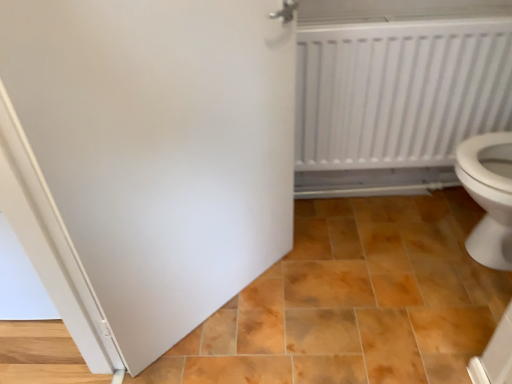
The width and height of the screenshot is (512, 384). What do you see at coordinates (149, 157) in the screenshot? I see `white matte door at center` at bounding box center [149, 157].

This screenshot has width=512, height=384. What do you see at coordinates (399, 88) in the screenshot?
I see `white plastic radiator at upper right` at bounding box center [399, 88].

This screenshot has height=384, width=512. What are the coordinates of `white matte door at center` in the screenshot? It's located at (149, 157).

Is white plastic radiator at upper right facing towards white matte door at center?

No, white plastic radiator at upper right is not turned towards white matte door at center.

How many degrees apart are the facing directions of white plastic radiator at upper right and white matte door at center?

44.3 degrees separate the facing orientations of white plastic radiator at upper right and white matte door at center.

Between white plastic radiator at upper right and white matte door at center, which one has more height?

Standing taller between the two is white matte door at center.

From a real-world perspective, is white plastic radiator at upper right positioned under white matte door at center based on gravity?

Yes, from a real-world perspective, white plastic radiator at upper right is below white matte door at center.

How different are the orientations of white matte door at center and brown glossy tile at center in degrees?

The angular difference between white matte door at center and brown glossy tile at center is 135 degrees.

Considering the sizes of objects white matte door at center and brown glossy tile at center in the image provided, who is thinner, white matte door at center or brown glossy tile at center?

With smaller width is white matte door at center.

Is white matte door at center beside brown glossy tile at center?

No, white matte door at center is not beside brown glossy tile at center.

In the image, there is a brown glossy tile at center. In order to click on door above it (from the image's perspective) in this screenshot , I will do `click(149, 157)`.

Considering the relative sizes of white matte door at center and white plastic radiator at upper right in the image provided, is white matte door at center taller than white plastic radiator at upper right?

Indeed, white matte door at center has a greater height compared to white plastic radiator at upper right.

This screenshot has width=512, height=384. I want to click on door below the white plastic radiator at upper right (from the image's perspective), so click(149, 157).

Would you say white matte door at center is a long distance from white plastic radiator at upper right?

They are positioned close to each other.

Looking at their sizes, would you say brown glossy tile at center is wider or thinner than white matte door at center?

Considering their sizes, brown glossy tile at center looks broader than white matte door at center.

Considering the sizes of brown glossy tile at center and white matte door at center in the image, is brown glossy tile at center bigger or smaller than white matte door at center?

brown glossy tile at center is bigger than white matte door at center.

Where is `door in front of the brown glossy tile at center`? The height and width of the screenshot is (384, 512). door in front of the brown glossy tile at center is located at coordinates (149, 157).

From the image's perspective, between brown glossy tile at center and white matte door at center, who is located below?

brown glossy tile at center, from the image's perspective.

Between brown glossy tile at center and white plastic radiator at upper right, which one has more height?

white plastic radiator at upper right.

Are brown glossy tile at center and white plastic radiator at upper right located far from each other?

That's not correct — brown glossy tile at center is a little close to white plastic radiator at upper right.

At what (x,y) coordinates should I click in order to perform the action: click on ceramic tile in front of the white plastic radiator at upper right. Please return your answer as a coordinate pair (x, y). This screenshot has width=512, height=384. Looking at the image, I should click on (355, 301).

Which is in front, point (488, 24) or point (418, 362)?

The point (418, 362) is closer.

Looking at the image, does white plastic radiator at upper right seem bigger or smaller compared to brown glossy tile at center?

In the image, white plastic radiator at upper right appears to be smaller than brown glossy tile at center.

Which object is positioned more to the right, white plastic radiator at upper right or brown glossy tile at center?

From the viewer's perspective, white plastic radiator at upper right appears more on the right side.

From a real-world perspective, which is physically above, white plastic radiator at upper right or brown glossy tile at center?

In real-world perspective, white plastic radiator at upper right is above.

Locate an element on the screen. This screenshot has height=384, width=512. radiator behind the white matte door at center is located at coordinates (399, 88).

Locate an element on the screen. The width and height of the screenshot is (512, 384). door in front of the brown glossy tile at center is located at coordinates (149, 157).

Based on their spatial positions, is white matte door at center or white plastic radiator at upper right further from brown glossy tile at center?

white plastic radiator at upper right is further to brown glossy tile at center.

Which object lies nearer to the anchor point brown glossy tile at center, white plastic radiator at upper right or white matte door at center?

Among the two, white matte door at center is located nearer to brown glossy tile at center.

Considering their positions, is brown glossy tile at center positioned further to white plastic radiator at upper right than white matte door at center?

The object further to white plastic radiator at upper right is white matte door at center.

From the image, which object appears to be farther from white matte door at center, brown glossy tile at center or white plastic radiator at upper right?

Based on the image, white plastic radiator at upper right appears to be further to white matte door at center.

Estimate the real-world distances between objects in this image. Which object is further from white plastic radiator at upper right, white matte door at center or brown glossy tile at center?

white matte door at center.

From the image, which object appears to be farther from white matte door at center, white plastic radiator at upper right or brown glossy tile at center?

white plastic radiator at upper right.

Locate an element on the screen. ceramic tile between white matte door at center and white plastic radiator at upper right from front to back is located at coordinates (355, 301).